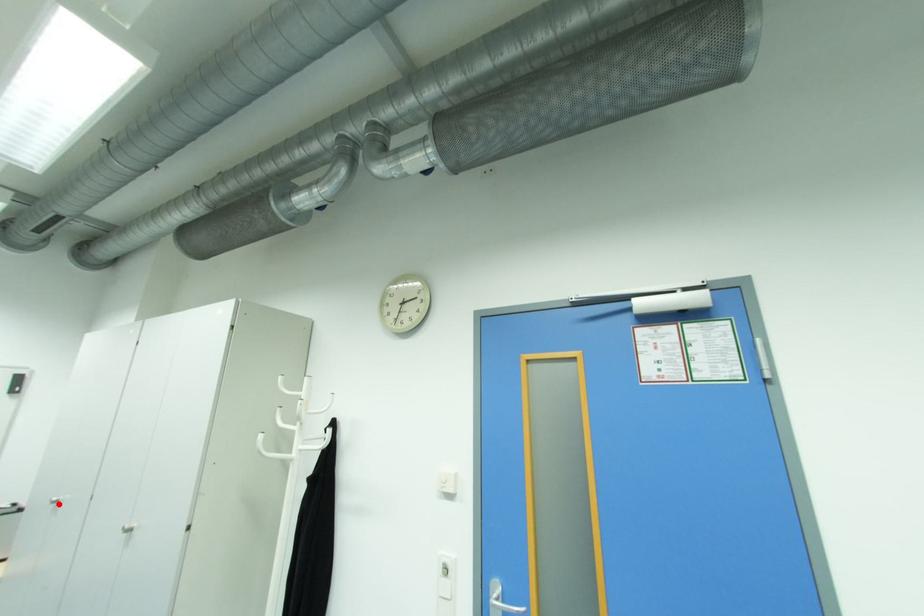
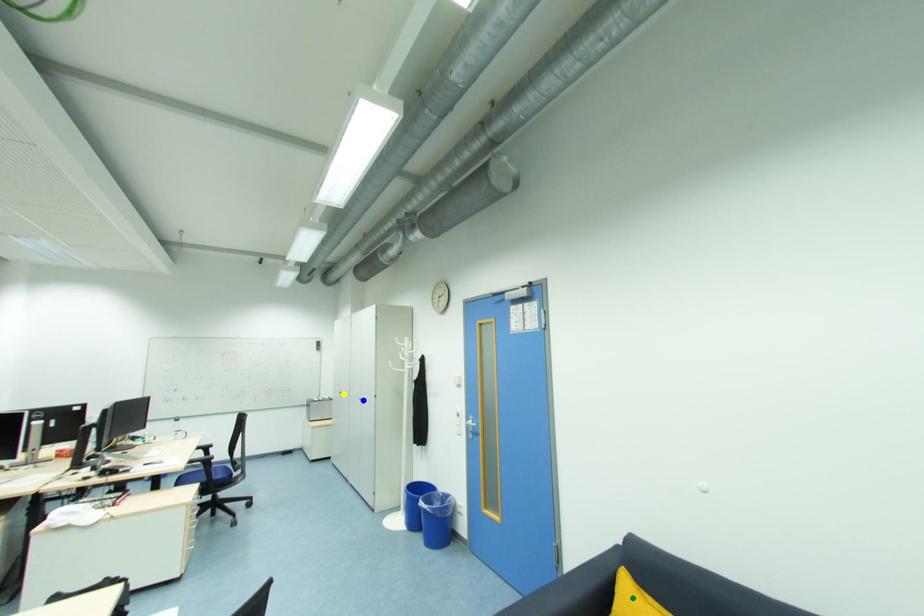
Question: I am providing you with two images of the same scene from different viewpoints. A red point is marked on the first image. You are given multiple points on the second image. Which spot in image 2 lines up with the point in image 1?

Choices:
 (A) blue point
 (B) yellow point
 (C) green point

Answer: (B)